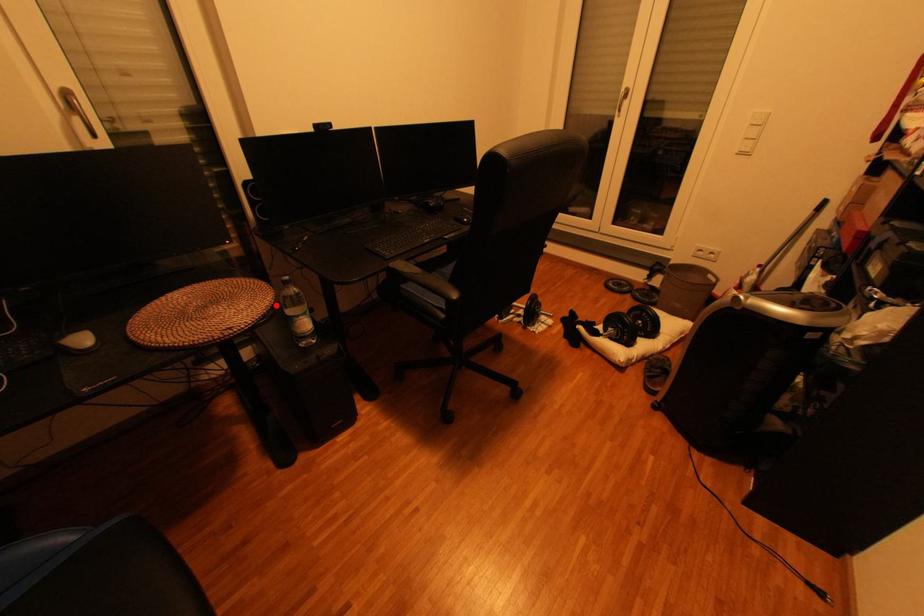
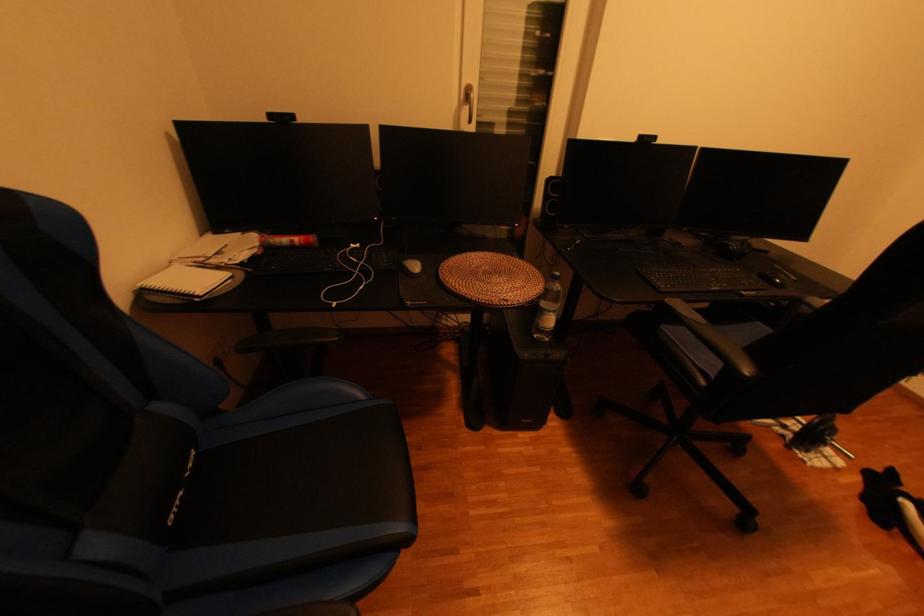
The point at the highlighted location is marked in the first image. Where is the corresponding point in the second image?

(546, 293)